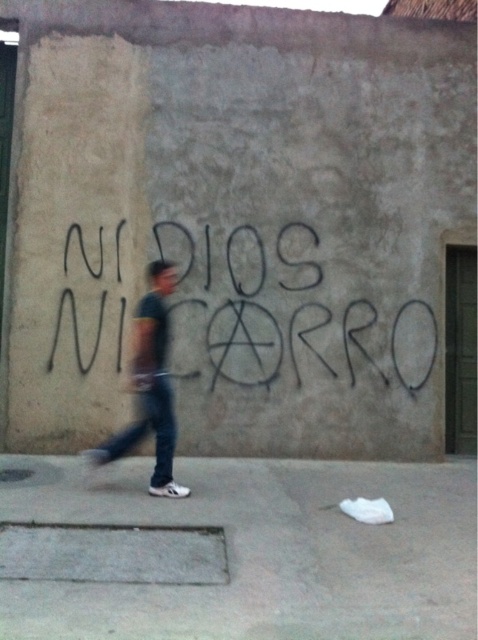
Question: Which is farther from the dark blue jeans at center?

Choices:
 (A) gray concrete pavement at lower center
 (B) black graffiti at center

Answer: (B)

Question: Among these objects, which one is nearest to the camera?

Choices:
 (A) gray concrete pavement at lower center
 (B) black graffiti at center
 (C) dark blue jeans at center

Answer: (A)

Question: In this image, where is gray concrete pavement at lower center located relative to dark blue jeans at center?

Choices:
 (A) left
 (B) right

Answer: (B)

Question: Is gray concrete pavement at lower center to the right of dark blue jeans at center from the viewer's perspective?

Choices:
 (A) no
 (B) yes

Answer: (B)

Question: Which of the following is the closest to the observer?

Choices:
 (A) (107, 497)
 (B) (167, 332)
 (C) (370, 305)

Answer: (A)

Question: Is gray concrete pavement at lower center below black graffiti at center?

Choices:
 (A) yes
 (B) no

Answer: (A)